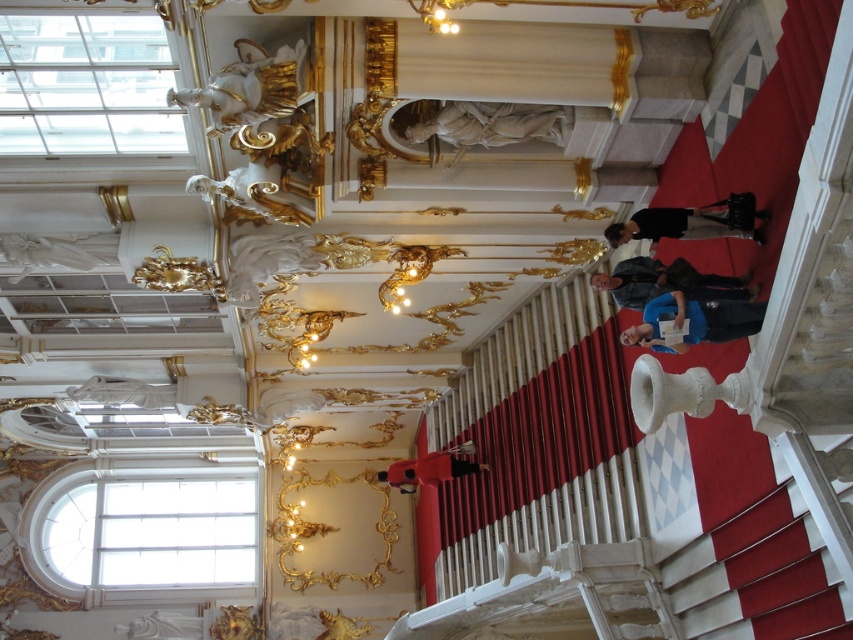
You are a security guard in the palace and need to place a small security camera on the wall behind the black leather bag at center and dark gray fabric jacket at center. Since the camera must be placed above both objects to monitor them, which object will require the camera to be placed higher?

The camera must be placed higher above the dark gray fabric jacket at center because it has a greater height than the black leather bag at center.